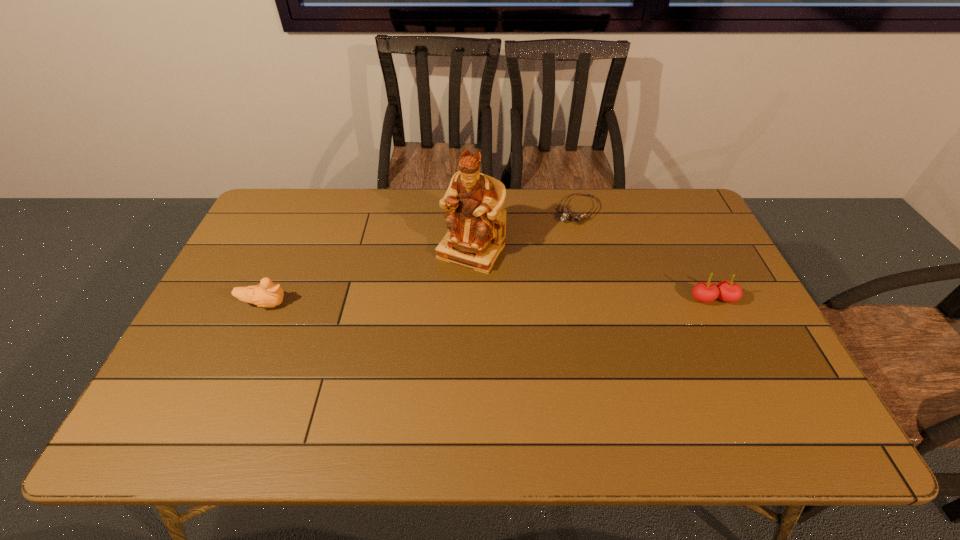
The image size is (960, 540). I want to click on vacant region located 0.400m on the front lenses and sides of the farthest object, so 516,304.

The width and height of the screenshot is (960, 540). I want to click on free space located on the front-facing side of the second farthest object, so click(437, 300).

The width and height of the screenshot is (960, 540). Find the location of `free location located 0.350m on the front-facing side of the second farthest object`. free location located 0.350m on the front-facing side of the second farthest object is located at coordinates (393, 366).

The width and height of the screenshot is (960, 540). I want to click on free spot located on the front-facing side of the second farthest object, so click(426, 316).

The height and width of the screenshot is (540, 960). In order to click on goggles that is at the far edge in this screenshot , I will do (x=577, y=217).

You are a GUI agent. You are given a task and a screenshot of the screen. Output one action in this format:
    pyautogui.click(x=<x>, y=<y>)
    Task: Click on the figurine situated at the far edge
    This screenshot has width=960, height=540.
    Given the screenshot: What is the action you would take?
    pyautogui.click(x=476, y=220)

This screenshot has height=540, width=960. In order to click on object located at the left edge in this screenshot , I will do `click(267, 294)`.

Locate an element on the screen. This screenshot has width=960, height=540. object located in the right edge section of the desktop is located at coordinates (728, 291).

You are a GUI agent. You are given a task and a screenshot of the screen. Output one action in this format:
    pyautogui.click(x=<x>, y=<y>)
    Task: Click on the vacant area at the far edge
    The height and width of the screenshot is (540, 960).
    Given the screenshot: What is the action you would take?
    pyautogui.click(x=573, y=198)

The width and height of the screenshot is (960, 540). What are the coordinates of `vacant area at the near edge` in the screenshot? It's located at (505, 393).